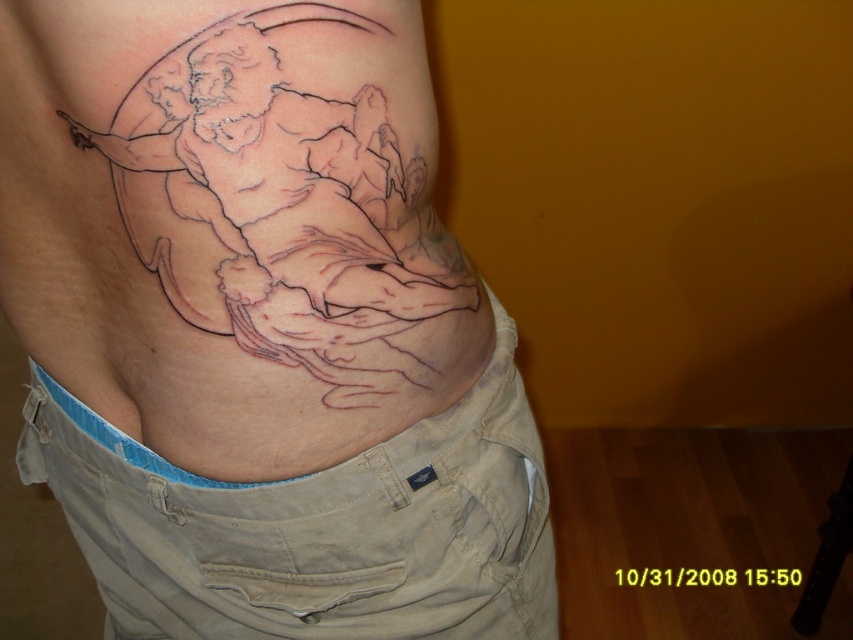
Which is more to the left, black ink tattoo at upper center or black ink tattoo at center?

Positioned to the left is black ink tattoo at upper center.

Between black ink tattoo at upper center and black ink tattoo at center, which one is positioned higher?

black ink tattoo at center is above.

At what (x,y) coordinates should I click in order to perform the action: click on black ink tattoo at upper center. Please return your answer as a coordinate pair (x, y). The width and height of the screenshot is (853, 640). Looking at the image, I should click on (260, 326).